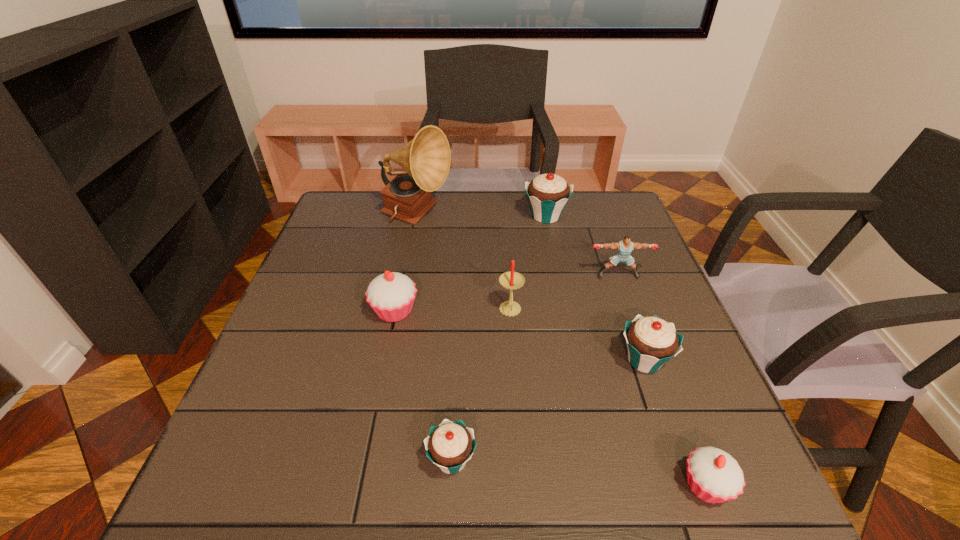
Find the location of a particular element. free location that satisfies the following two spatial constraints: 1. on the horn of the tallest object; 2. on the front side of the fourth nearest cupcake is located at coordinates (398, 312).

I want to click on free spot that satisfies the following two spatial constraints: 1. on the back side of the nearest teal cupcake; 2. on the right side of the tallest cupcake, so click(x=464, y=216).

The image size is (960, 540). In order to click on free space that satisfies the following two spatial constraints: 1. on the back side of the fourth object from left to right; 2. on the horn of the tallest object in this screenshot , I will do 504,217.

Identify the location of vacant region that satisfies the following two spatial constraints: 1. on the back side of the right pink cupcake; 2. on the horn of the tallest object. (604, 217).